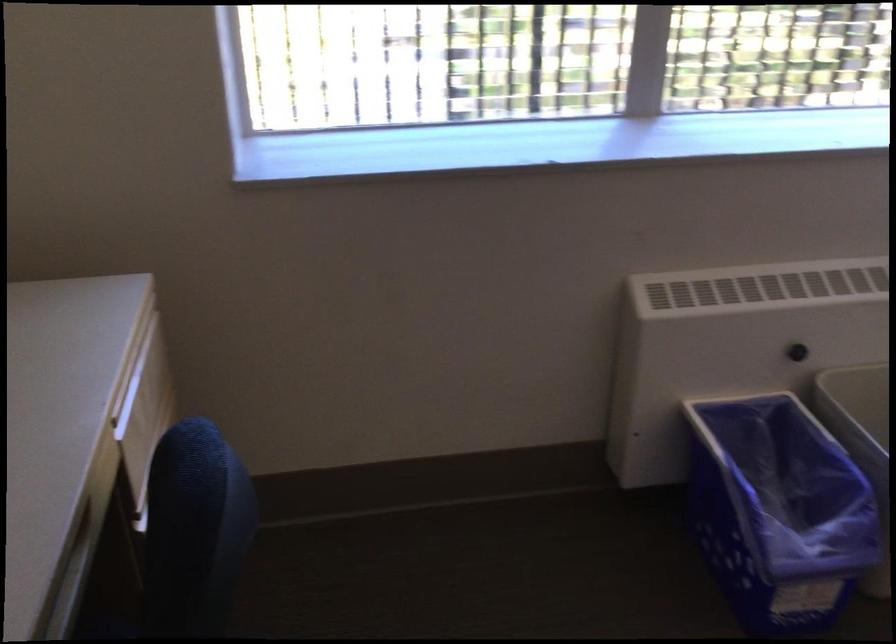
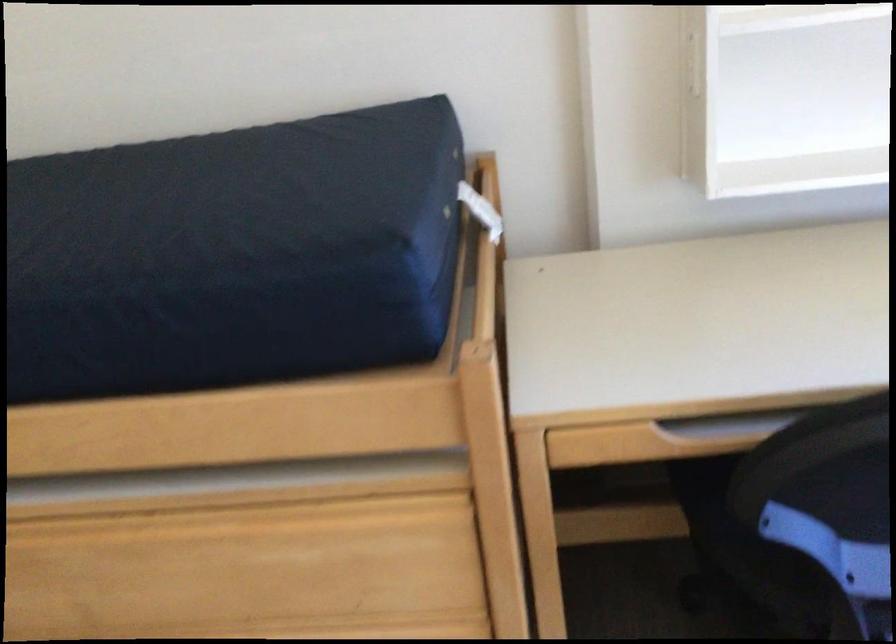
First-person continuous shooting, in which direction is the camera rotating?

The camera's rotation is toward left-down.